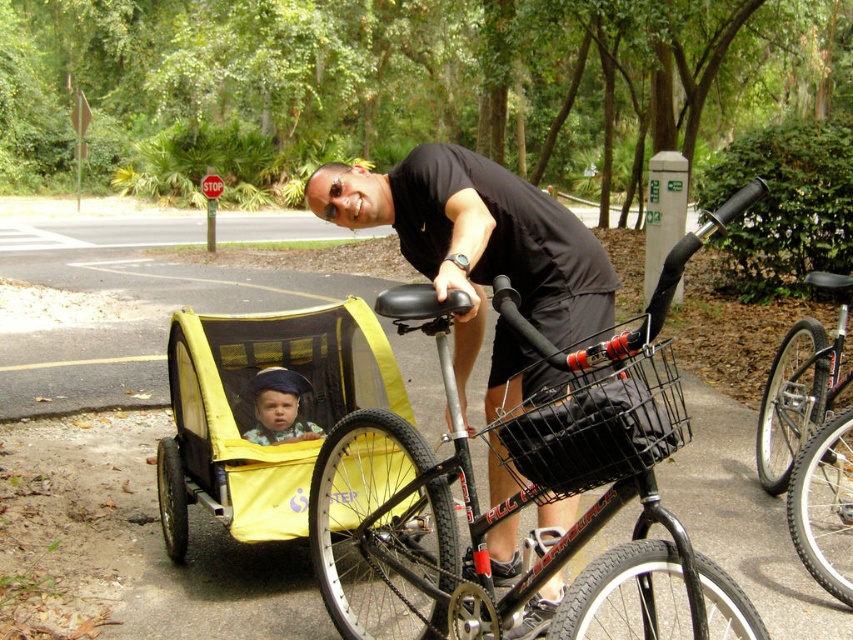
Question: Is yellow fabric baby carriage at center wider than black wire basket at center?

Choices:
 (A) no
 (B) yes

Answer: (B)

Question: Where is yellow fabric baby carriage at center located in relation to black matte bicycle at right in the image?

Choices:
 (A) right
 (B) left

Answer: (B)

Question: Estimate the real-world distances between objects in this image. Which object is farther from the black matte bicycle at right?

Choices:
 (A) blue denim hat at center
 (B) black wire basket at center
 (C) black matte shirt at center

Answer: (B)

Question: Which object is positioned farthest from the black matte bicycle at right?

Choices:
 (A) shiny silver wheel at lower right
 (B) blue denim hat at center

Answer: (B)

Question: Does yellow fabric baby carriage at center appear over blue denim hat at center?

Choices:
 (A) yes
 (B) no

Answer: (B)

Question: Among these objects, which one is nearest to the camera?

Choices:
 (A) blue denim hat at center
 (B) yellow fabric baby carriage at center
 (C) black matte bicycle at right

Answer: (B)